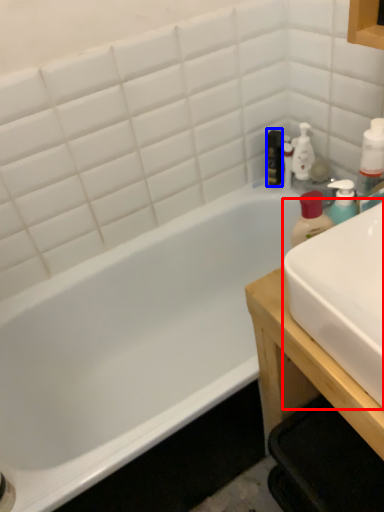
Question: Among these objects, which one is farthest to the camera, sink (highlighted by a red box) or mouthwash (highlighted by a blue box)?

Choices:
 (A) sink
 (B) mouthwash

Answer: (B)